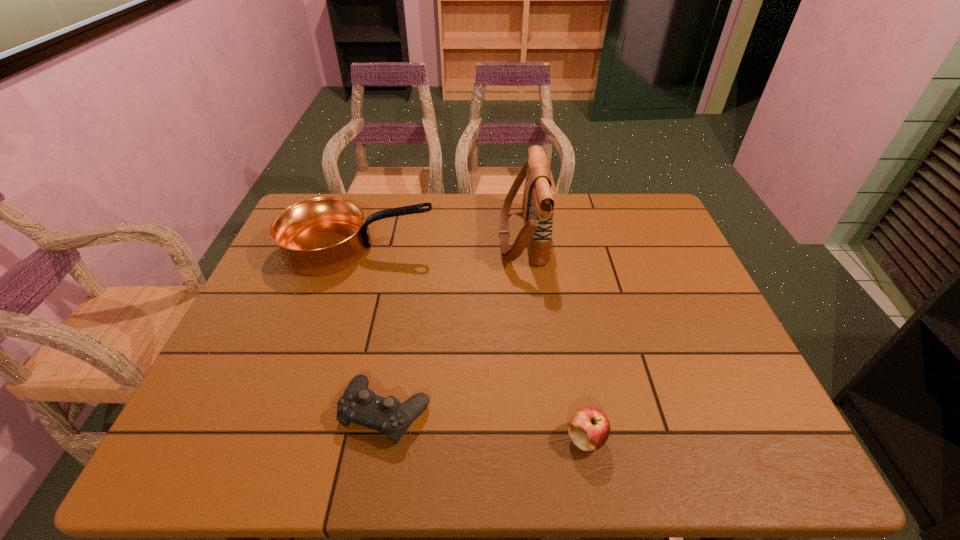
This screenshot has width=960, height=540. In order to click on shoulder bag in this screenshot , I will do `click(538, 204)`.

Where is `frying pan`? This screenshot has height=540, width=960. frying pan is located at coordinates (320, 236).

Where is `apple`? The width and height of the screenshot is (960, 540). apple is located at coordinates (589, 428).

Image resolution: width=960 pixels, height=540 pixels. I want to click on control, so click(359, 405).

What are the coordinates of `free point located 0.060m on the front-facing side of the shoulder bag` in the screenshot? It's located at (479, 236).

At what (x,y) coordinates should I click in order to perform the action: click on free point located on the front-facing side of the shoulder bag. Please return your answer as a coordinate pair (x, y). This screenshot has height=540, width=960. Looking at the image, I should click on (418, 236).

Where is `vacant space located 0.140m on the front-facing side of the shoulder bag`? This screenshot has height=540, width=960. vacant space located 0.140m on the front-facing side of the shoulder bag is located at coordinates (453, 236).

The height and width of the screenshot is (540, 960). In order to click on free space located 0.360m on the handle side of the third shortest object in this screenshot , I will do `click(556, 248)`.

This screenshot has width=960, height=540. I want to click on free spot located on the left of the apple, so click(521, 438).

Find the location of a particular element. free spot located 0.280m on the left of the control is located at coordinates (210, 411).